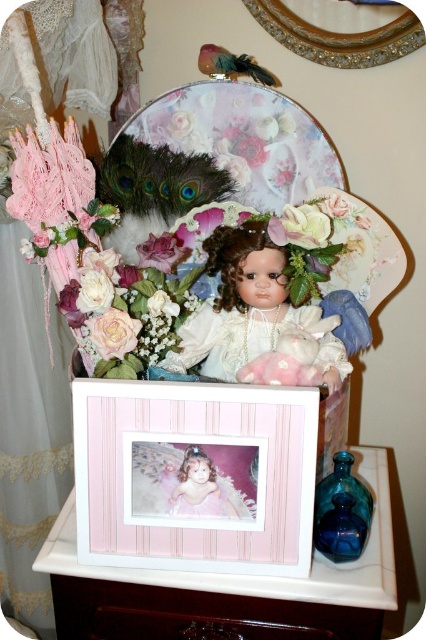
Does point (63, 179) lie behind point (173, 260)?

No, it is in front of (173, 260).

At what (x,y) coordinates should I click in order to perform the action: click on floral bouquet at upper center. Please return your answer as a coordinate pair (x, y). Looking at the image, I should click on [x=336, y=260].

Can you confirm if matte pink rose at center is positioned to the left of pink silk flower at center?

Yes, matte pink rose at center is to the left of pink silk flower at center.

How much distance is there between matte pink rose at center and pink silk flower at center?

They are 5.85 inches apart.

Which is in front, point (134, 340) or point (140, 266)?

Point (134, 340)

Where is `matte pink rose at center`? matte pink rose at center is located at coordinates (112, 332).

Is point (247, 340) farther from viewer compared to point (112, 352)?

Yes, point (247, 340) is farther from viewer.

Is porcelain doll at center shorter than matte pink rose at center?

No.

Locate an element on the screen. The width and height of the screenshot is (426, 640). porcelain doll at center is located at coordinates (238, 304).

You are a GUI agent. You are given a task and a screenshot of the screen. Output one action in this format:
    pyautogui.click(x=<x>, y=<y>)
    Task: Click on the porcelain doll at center
    This screenshot has width=426, height=640.
    Given the screenshot: What is the action you would take?
    pyautogui.click(x=238, y=304)